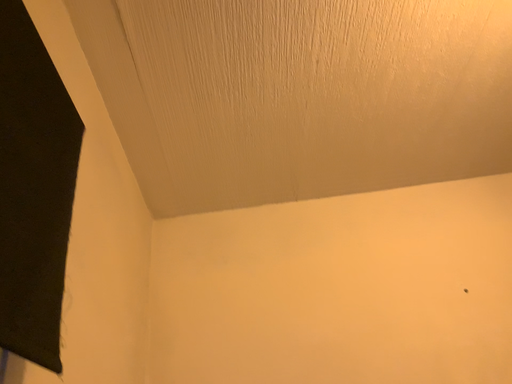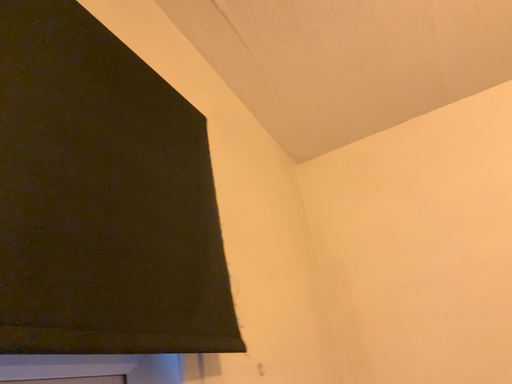
Question: Which way did the camera rotate in the video?

Choices:
 (A) rotated right
 (B) rotated left

Answer: (B)